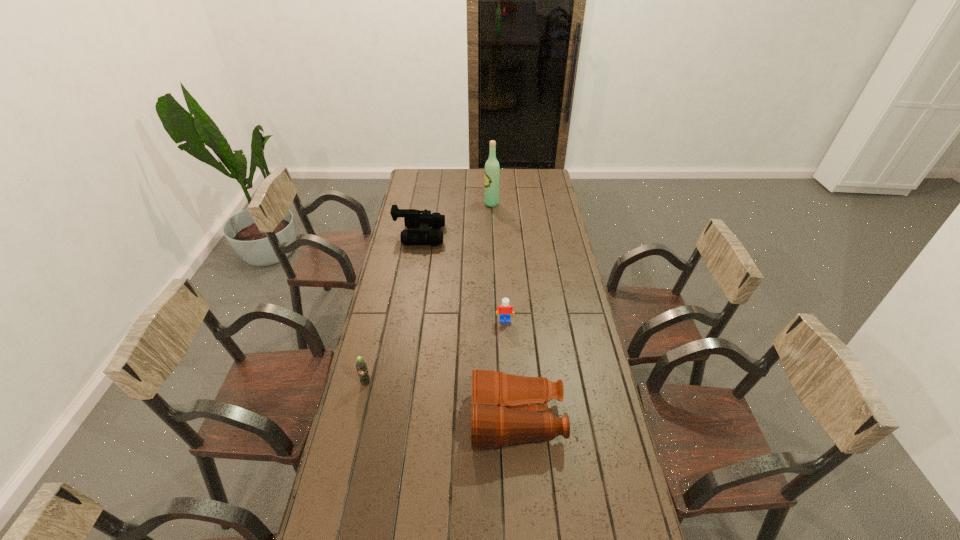
I want to click on vacant region at the far edge of the desktop, so click(x=437, y=188).

Where is `free space at the left edge`? The width and height of the screenshot is (960, 540). free space at the left edge is located at coordinates (389, 304).

The width and height of the screenshot is (960, 540). What are the coordinates of `free point at the right edge` in the screenshot? It's located at (549, 209).

The width and height of the screenshot is (960, 540). Identify the location of empty location between the soda and the third farthest object. (435, 352).

Where is `empty space that is in between the soda and the farther binoculars`? empty space that is in between the soda and the farther binoculars is located at coordinates (393, 309).

At what (x,y) coordinates should I click in order to perform the action: click on free area in between the soda and the wine bottle. Please return your answer as a coordinate pair (x, y). The width and height of the screenshot is (960, 540). Looking at the image, I should click on (428, 293).

You are a GUI agent. You are given a task and a screenshot of the screen. Output one action in this format:
    pyautogui.click(x=<x>, y=<y>)
    Task: Click on the free area in between the soda and the wine bottle
    This screenshot has width=960, height=540.
    Given the screenshot: What is the action you would take?
    pyautogui.click(x=428, y=293)

The image size is (960, 540). I want to click on free spot between the tallest object and the soda, so click(428, 293).

You are a GUI agent. You are given a task and a screenshot of the screen. Output one action in this format:
    pyautogui.click(x=<x>, y=<y>)
    Task: Click on the vacant point located between the Lego and the soda
    The width and height of the screenshot is (960, 540).
    Given the screenshot: What is the action you would take?
    pyautogui.click(x=435, y=352)

Point out which object is positioned as the nearest to the tallest object. Please provide its 2D coordinates. Your answer should be formatted as a tuple, i.e. [(x, y)], where the tuple contains the x and y coordinates of a point satisfying the conditions above.

[(413, 219)]